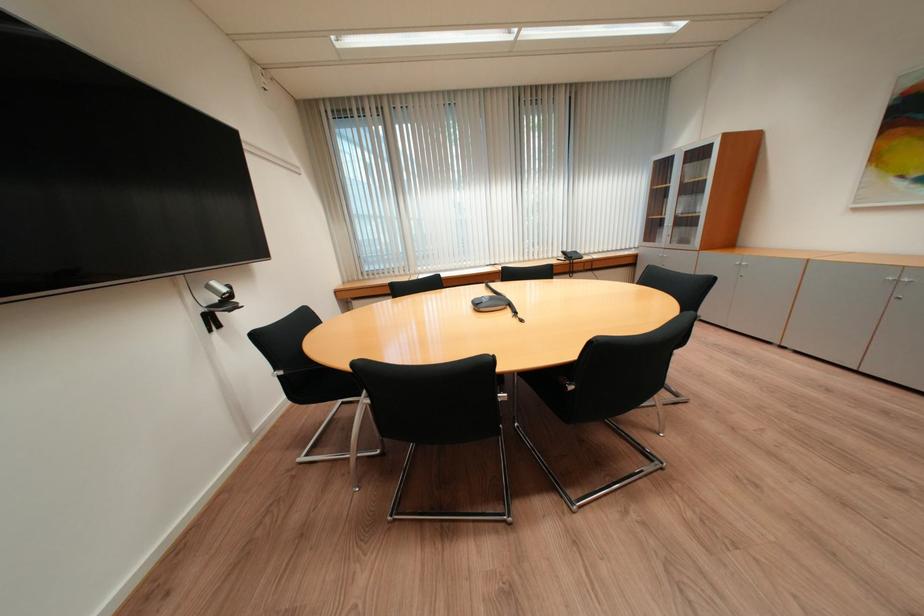
Identify the location of black telephone handset. The image size is (924, 616). (482, 302).